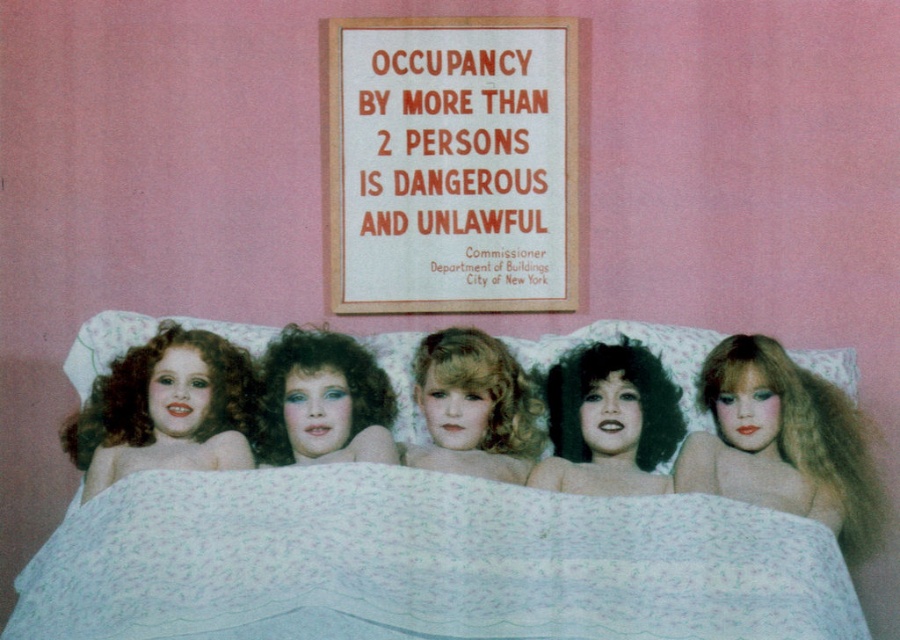
Question: Is white floral fabric bed at center above blonde curly hair at center?

Choices:
 (A) yes
 (B) no

Answer: (B)

Question: Which object appears closest to the camera in this image?

Choices:
 (A) curly-haired doll at left
 (B) white floral fabric bed at center

Answer: (B)

Question: Does blonde hair doll at center have a larger size compared to white floral fabric pillow at center?

Choices:
 (A) no
 (B) yes

Answer: (B)

Question: Which point is farther from the camera taking this photo?

Choices:
 (A) (286, 474)
 (B) (279, 340)

Answer: (B)

Question: Does white paper sign at upper center appear on the left side of shiny plastic doll at center?

Choices:
 (A) no
 (B) yes

Answer: (A)

Question: Which object is farther from the camera taking this photo?

Choices:
 (A) white floral fabric bed at center
 (B) shiny plastic doll at center

Answer: (B)